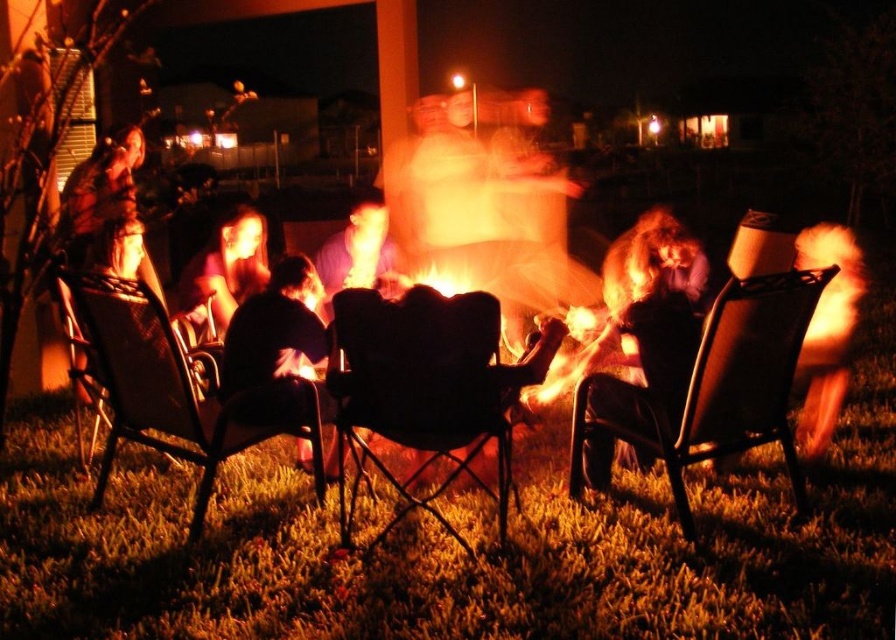
Between black fabric chair at center and metallic black chair at left, which one is positioned higher?

metallic black chair at left

Can you confirm if black fabric chair at center is positioned to the right of metallic black chair at left?

Correct, you'll find black fabric chair at center to the right of metallic black chair at left.

This screenshot has width=896, height=640. Describe the element at coordinates (418, 388) in the screenshot. I see `black fabric chair at center` at that location.

Find the location of `black fabric chair at center`. black fabric chair at center is located at coordinates (418, 388).

Between point (250, 428) and point (282, 278), which one is positioned behind?

The point (282, 278) is behind.

Can you confirm if metallic black chair at left is positioned to the left of dark fabric chair at center?

Indeed, metallic black chair at left is positioned on the left side of dark fabric chair at center.

The image size is (896, 640). What do you see at coordinates (170, 388) in the screenshot? I see `metallic black chair at left` at bounding box center [170, 388].

Locate an element on the screen. metallic black chair at left is located at coordinates (170, 388).

Who is taller, metallic black chair at left or black leather chair at left?

Standing taller between the two is metallic black chair at left.

Between metallic black chair at left and black leather chair at left, which one appears on the left side from the viewer's perspective?

black leather chair at left

What are the coordinates of `metallic black chair at left` in the screenshot? It's located at (170, 388).